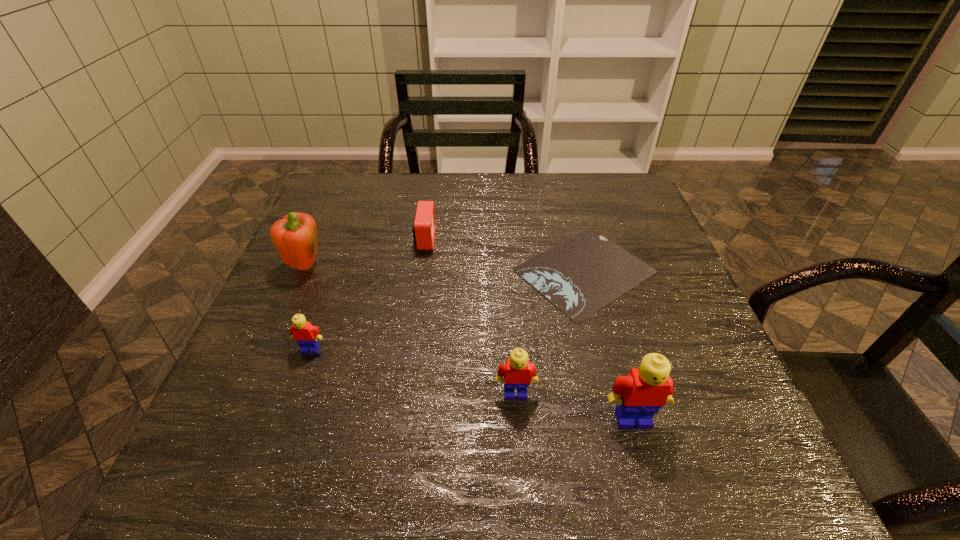
If the aim is uniform spacing by inserting an additional Lego among them, please point to a vacant space for this new Lego. Please provide its 2D coordinates. Your answer should be formatted as a tuple, i.e. [(x, y)], where the tuple contains the x and y coordinates of a point satisfying the conditions above.

[(408, 370)]